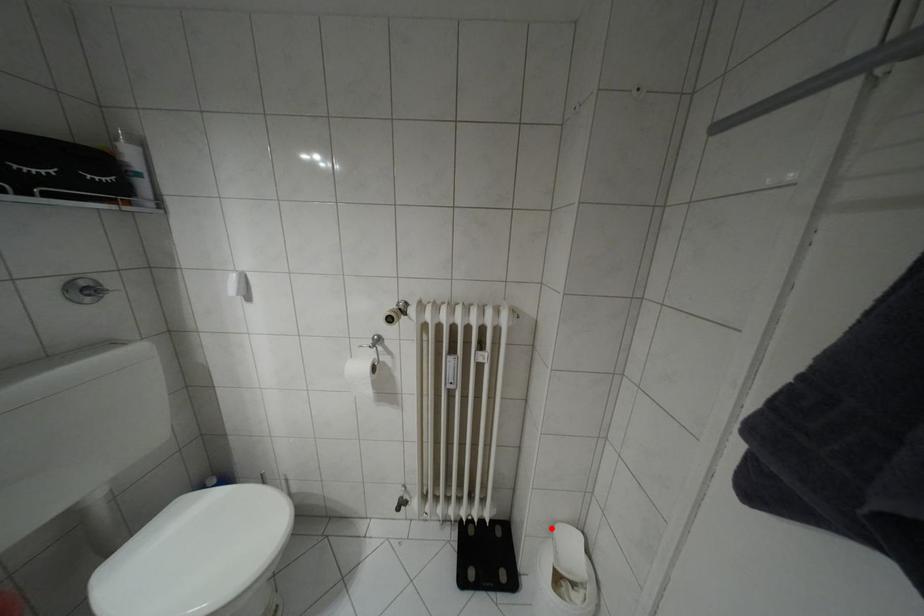
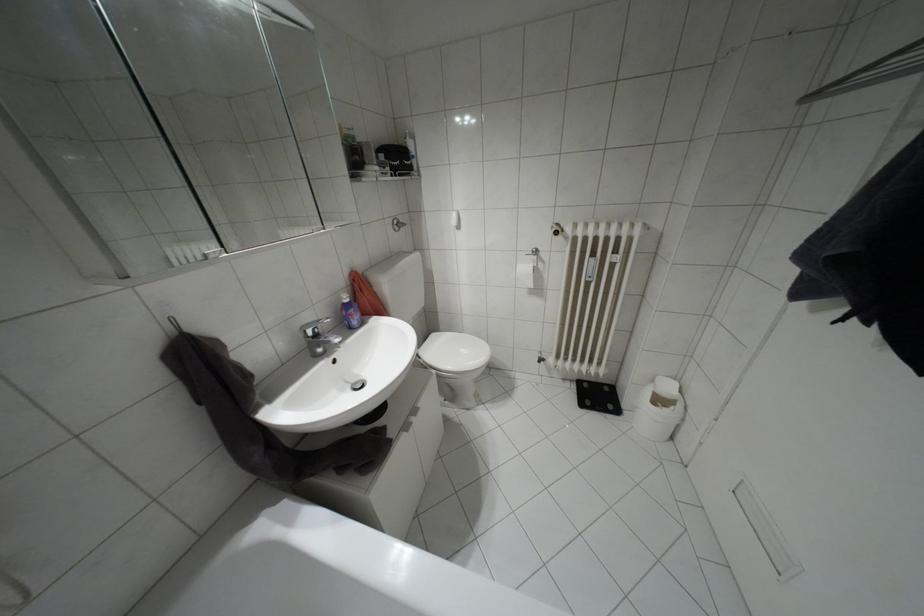
Question: I am providing you with two images of the same scene from different viewpoints. Image1 has a red point marked. In image2, the corresponding 3D location appears at what relative position? Reply with the corresponding letter.

Choices:
 (A) Closer
 (B) Farther

Answer: (A)